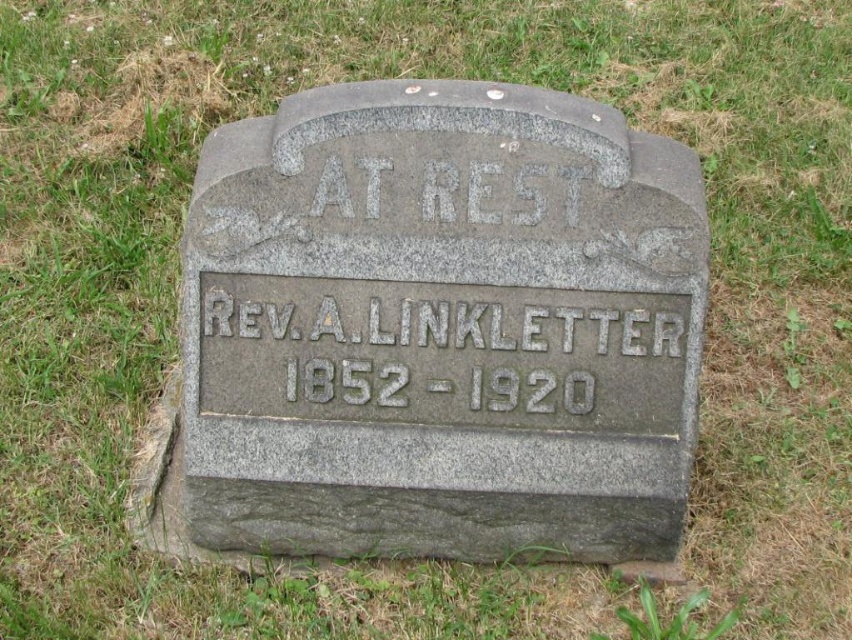
Question: Is gray stone gravestone at center to the right of gray granite inscription at center from the viewer's perspective?

Choices:
 (A) yes
 (B) no

Answer: (B)

Question: Which of the following is the farthest from the observer?

Choices:
 (A) gray granite inscription at center
 (B) gray stone gravestone at center

Answer: (A)

Question: Which point is farther to the camera?

Choices:
 (A) gray granite inscription at center
 (B) gray stone gravestone at center

Answer: (A)

Question: Observing the image, what is the correct spatial positioning of gray stone gravestone at center in reference to gray granite inscription at center?

Choices:
 (A) below
 (B) above

Answer: (A)

Question: Is gray stone gravestone at center smaller than gray granite inscription at center?

Choices:
 (A) no
 (B) yes

Answer: (A)